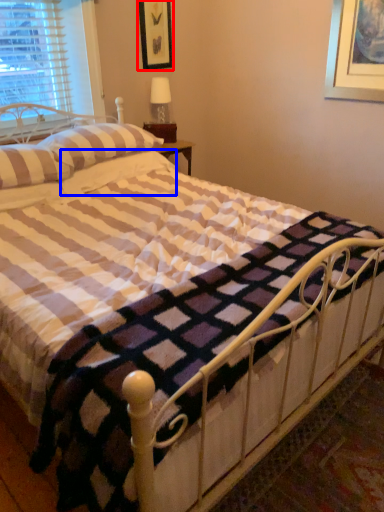
Question: Which object appears farthest to the camera in this image, picture frame (highlighted by a red box) or pillow (highlighted by a blue box)?

Choices:
 (A) picture frame
 (B) pillow

Answer: (A)